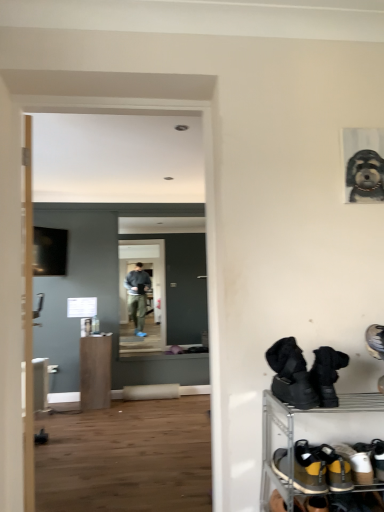
Question: Is black suede boots at lower right, which is the third footwear from bottom to top, positioned behind yellow suede sneakers at lower right, the first footwear in the bottom-to-top sequence?

Choices:
 (A) no
 (B) yes

Answer: (B)

Question: From a real-world perspective, is black suede boots at lower right, arranged as the first footwear when viewed from the top, below yellow suede sneakers at lower right, which is the third footwear from top to bottom?

Choices:
 (A) yes
 (B) no

Answer: (B)

Question: From the image's perspective, is black suede boots at lower right, arranged as the first footwear when viewed from the top, beneath yellow suede sneakers at lower right, which is the third footwear from top to bottom?

Choices:
 (A) yes
 (B) no

Answer: (B)

Question: Is black suede boots at lower right, arranged as the first footwear when viewed from the top, outside yellow suede sneakers at lower right, the first footwear in the bottom-to-top sequence?

Choices:
 (A) yes
 (B) no

Answer: (A)

Question: Is the depth of black suede boots at lower right, arranged as the first footwear when viewed from the top, less than that of yellow suede sneakers at lower right, which is the third footwear from top to bottom?

Choices:
 (A) no
 (B) yes

Answer: (A)

Question: Is black suede boots at lower right, arranged as the first footwear when viewed from the top, next to yellow suede sneakers at lower right, the first footwear in the bottom-to-top sequence?

Choices:
 (A) no
 (B) yes

Answer: (A)

Question: From a real-world perspective, is black suede boots at lower right, arranged as the first footwear when viewed from the top, below transparent glass door at center?

Choices:
 (A) yes
 (B) no

Answer: (A)

Question: Does black suede boots at lower right, which is the third footwear from bottom to top, appear on the right side of transparent glass door at center?

Choices:
 (A) no
 (B) yes

Answer: (B)

Question: Is black suede boots at lower right, arranged as the first footwear when viewed from the top, positioned before transparent glass door at center?

Choices:
 (A) yes
 (B) no

Answer: (A)

Question: Considering the relative sizes of black suede boots at lower right, arranged as the first footwear when viewed from the top, and transparent glass door at center in the image provided, is black suede boots at lower right, arranged as the first footwear when viewed from the top, shorter than transparent glass door at center?

Choices:
 (A) yes
 (B) no

Answer: (A)

Question: From a real-world perspective, is black suede boots at lower right, arranged as the first footwear when viewed from the top, physically above transparent glass door at center?

Choices:
 (A) no
 (B) yes

Answer: (A)

Question: Is transparent glass door at center completely or partially inside black suede boots at lower right, arranged as the first footwear when viewed from the top?

Choices:
 (A) no
 (B) yes

Answer: (A)

Question: Does yellow suede sneakers at lower right, which is the third footwear from top to bottom, touch black suede boots at lower right, arranged as the first footwear when viewed from the top?

Choices:
 (A) yes
 (B) no

Answer: (B)